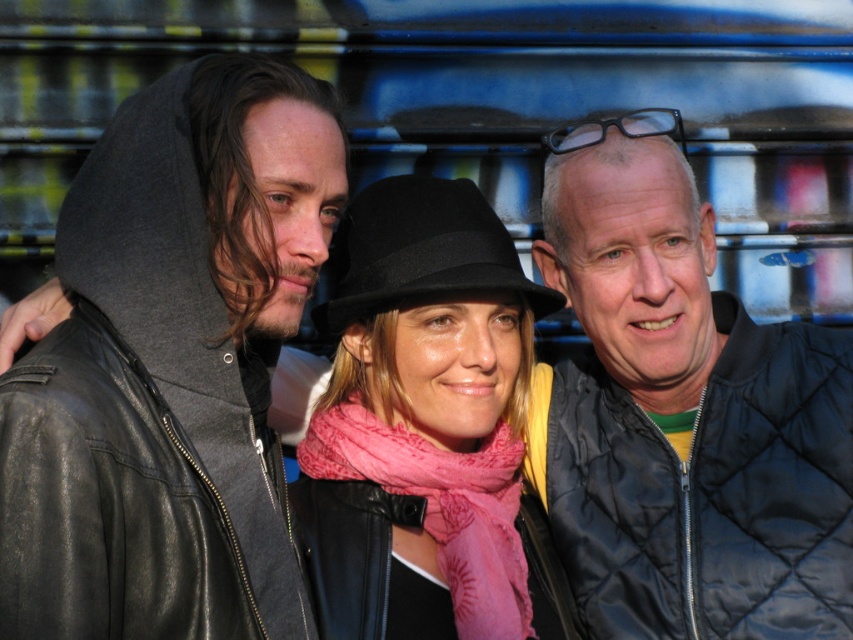
Question: Which of these objects is positioned farthest from the leather jacket at left?

Choices:
 (A) pink silk scarf at center
 (B) pink fabric scarf at center
 (C) black felt fedora at center

Answer: (A)

Question: Can you confirm if leather jacket at left is wider than pink silk scarf at center?

Choices:
 (A) no
 (B) yes

Answer: (B)

Question: Based on their relative distances, which object is nearer to the black felt fedora at center?

Choices:
 (A) leather jacket at left
 (B) quilted black jacket at right
 (C) pink silk scarf at center
 (D) pink fabric scarf at center

Answer: (D)

Question: Among these objects, which one is farthest from the camera?

Choices:
 (A) leather jacket at left
 (B) black felt fedora at center
 (C) quilted black jacket at right

Answer: (C)

Question: Does quilted black jacket at right have a greater width compared to pink fabric scarf at center?

Choices:
 (A) no
 (B) yes

Answer: (B)

Question: Is quilted black jacket at right to the left of pink silk scarf at center from the viewer's perspective?

Choices:
 (A) yes
 (B) no

Answer: (B)